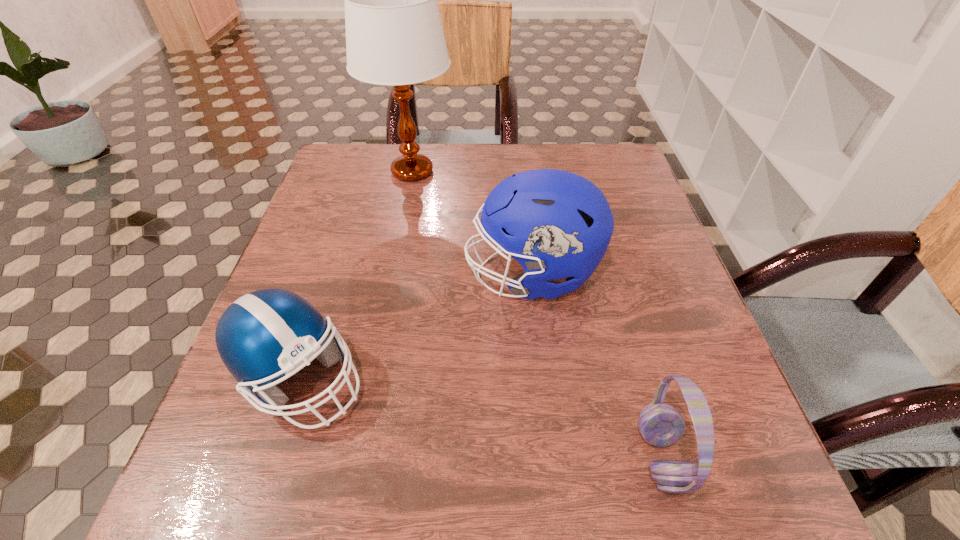
Where is `free space located on the front-facing side of the right football helmet`? This screenshot has height=540, width=960. free space located on the front-facing side of the right football helmet is located at coordinates (x=431, y=274).

Where is `vacant space situated at the front of the shorter football helmet with the faceguard`? vacant space situated at the front of the shorter football helmet with the faceguard is located at coordinates (586, 379).

This screenshot has height=540, width=960. In order to click on free region located on the headband and ear cups of the headset in this screenshot , I will do `click(389, 457)`.

You are a GUI agent. You are given a task and a screenshot of the screen. Output one action in this format:
    pyautogui.click(x=<x>, y=<y>)
    Task: Click on the vacant position located on the headband and ear cups of the headset
    Image resolution: width=960 pixels, height=540 pixels.
    Given the screenshot: What is the action you would take?
    pyautogui.click(x=444, y=457)

You are a GUI agent. You are given a task and a screenshot of the screen. Output one action in this format:
    pyautogui.click(x=<x>, y=<y>)
    Task: Click on the free space located 0.170m on the headband and ear cups of the headset
    
    Given the screenshot: What is the action you would take?
    pyautogui.click(x=524, y=457)

At what (x,y) coordinates should I click in order to perform the action: click on object that is positioned at the far edge. Please return your answer as a coordinate pair (x, y). Looking at the image, I should click on point(394,36).

Find the location of a particular element. object that is positioned at the near edge is located at coordinates (661, 425).

This screenshot has width=960, height=540. Identify the location of table lamp that is at the left edge. (394, 36).

I want to click on football helmet present at the left edge, so click(263, 335).

Locate an element on the screen. This screenshot has height=540, width=960. object that is at the right edge is located at coordinates coord(661,425).